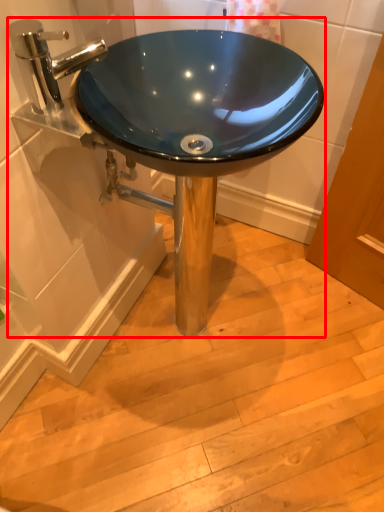
Question: From the image's perspective, what is the correct spatial relationship of sink (annotated by the red box) in relation to tap?

Choices:
 (A) above
 (B) below

Answer: (B)